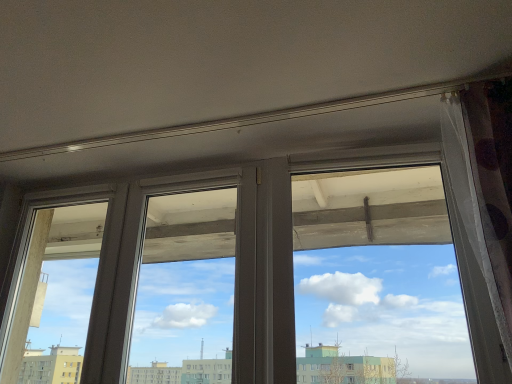
What is the approximate height of transparent plastic window screen at upper right?

transparent plastic window screen at upper right is 37.80 inches tall.

Where is `transparent plastic window screen at upper right`? This screenshot has width=512, height=384. transparent plastic window screen at upper right is located at coordinates (377, 280).

This screenshot has width=512, height=384. Describe the element at coordinates (377, 280) in the screenshot. I see `transparent plastic window screen at upper right` at that location.

Where is `transparent plastic window screen at upper right`? transparent plastic window screen at upper right is located at coordinates point(377,280).